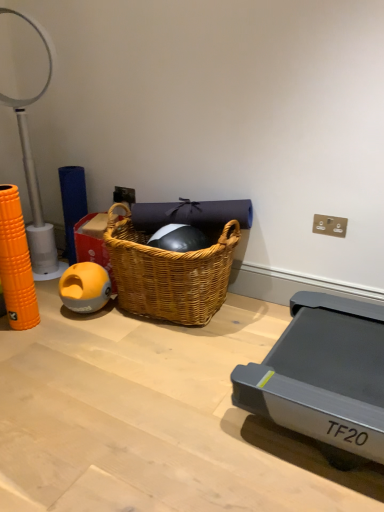
Question: Can you confirm if woven wood picnic basket at center is positioned to the right of yellow rubber ball at left?

Choices:
 (A) no
 (B) yes

Answer: (B)

Question: From a real-world perspective, is woven wood picnic basket at center physically above yellow rubber ball at left?

Choices:
 (A) no
 (B) yes

Answer: (B)

Question: Is woven wood picnic basket at center surrounding yellow rubber ball at left?

Choices:
 (A) no
 (B) yes

Answer: (A)

Question: From the image's perspective, is woven wood picnic basket at center located above yellow rubber ball at left?

Choices:
 (A) yes
 (B) no

Answer: (A)

Question: Is woven wood picnic basket at center bigger than yellow rubber ball at left?

Choices:
 (A) yes
 (B) no

Answer: (A)

Question: Would you say wooden floor at lower left is to the left or to the right of woven wood picnic basket at center in the picture?

Choices:
 (A) left
 (B) right

Answer: (A)

Question: From the image's perspective, is wooden floor at lower left located above or below woven wood picnic basket at center?

Choices:
 (A) above
 (B) below

Answer: (B)

Question: Considering the positions of wooden floor at lower left and woven wood picnic basket at center in the image, is wooden floor at lower left bigger or smaller than woven wood picnic basket at center?

Choices:
 (A) small
 (B) big

Answer: (A)

Question: Is wooden floor at lower left wider or thinner than woven wood picnic basket at center?

Choices:
 (A) thin
 (B) wide

Answer: (B)

Question: Does point tap(188, 323) appear closer or farther from the camera than point tap(41, 245)?

Choices:
 (A) farther
 (B) closer

Answer: (B)

Question: Is woven wood picnic basket at center inside the boundaries of white plastic table lamp at left, or outside?

Choices:
 (A) outside
 (B) inside

Answer: (A)

Question: From the image's perspective, relative to white plastic table lamp at left, is woven wood picnic basket at center above or below?

Choices:
 (A) below
 (B) above

Answer: (A)

Question: In the image, is woven wood picnic basket at center positioned in front of or behind white plastic table lamp at left?

Choices:
 (A) front
 (B) behind

Answer: (A)

Question: Based on their positions, is yellow rubber ball at left located to the left or right of woven wood picnic basket at center?

Choices:
 (A) left
 (B) right

Answer: (A)

Question: From a real-world perspective, is yellow rubber ball at left positioned above or below woven wood picnic basket at center?

Choices:
 (A) above
 (B) below

Answer: (B)